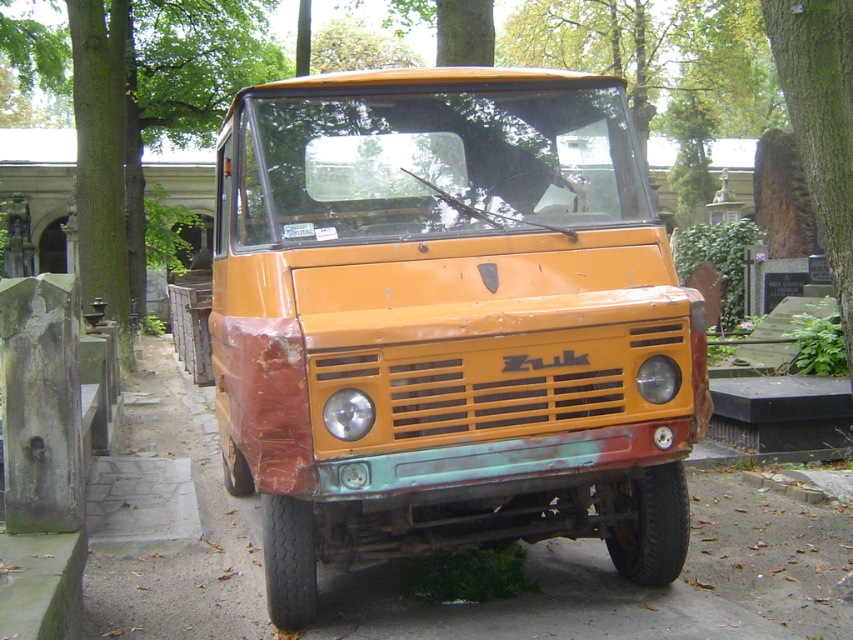
Is smooth concrete pavement at center above green rough bark tree at left?

No, smooth concrete pavement at center is not above green rough bark tree at left.

Between point (140, 385) and point (111, 106), which one is positioned behind?

Positioned behind is point (111, 106).

Between point (786, 516) and point (38, 58), which one is positioned in front?

Point (786, 516) is more forward.

Find the location of a particular element. smooth concrete pavement at center is located at coordinates (635, 586).

Who is positioned more to the left, rusty orange truck at center or smooth concrete pavement at center?

From the viewer's perspective, smooth concrete pavement at center appears more on the left side.

How distant is rusty orange truck at center from smooth concrete pavement at center?

rusty orange truck at center and smooth concrete pavement at center are 1.35 meters apart from each other.

Which is in front, point (540, 515) or point (663, 630)?

Point (663, 630) is in front.

Identify the location of rusty orange truck at center. (448, 323).

Is rusty orange truck at center to the left of green rough bark tree at left from the viewer's perspective?

No, rusty orange truck at center is not to the left of green rough bark tree at left.

Where is `rusty orange truck at center`? rusty orange truck at center is located at coordinates (448, 323).

Image resolution: width=853 pixels, height=640 pixels. Identify the location of rusty orange truck at center. (448, 323).